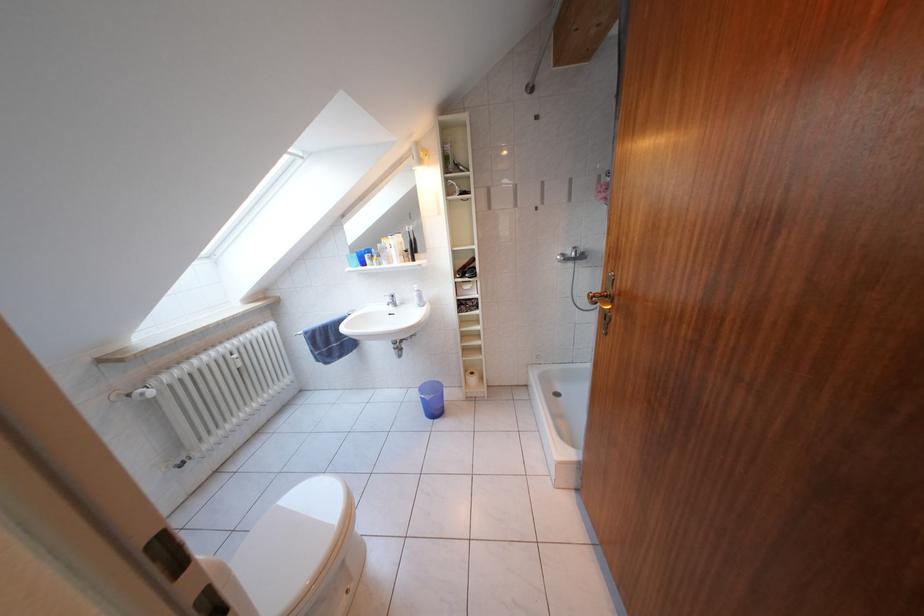
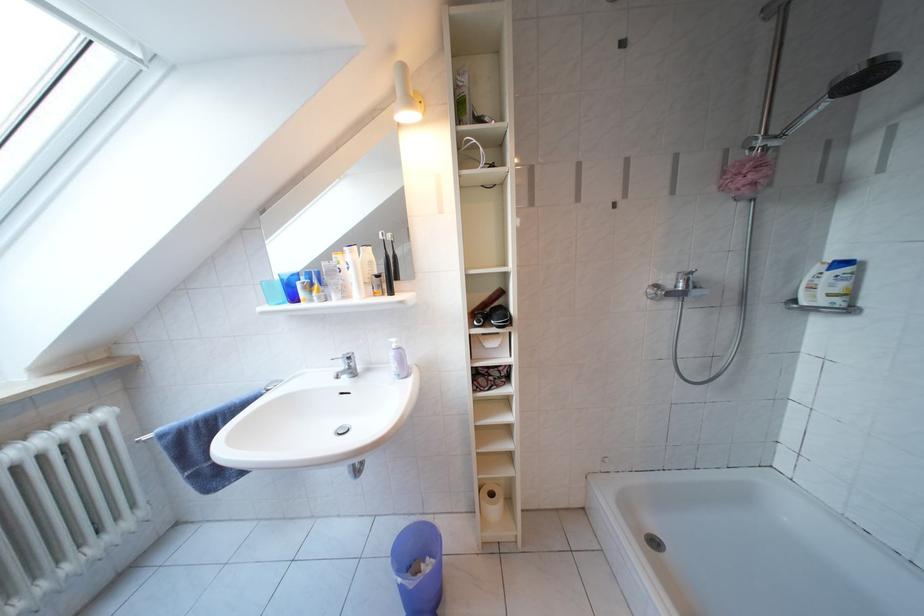
Find the pixel in the second image that matches pixel 435 403 in the first image.

(419, 589)